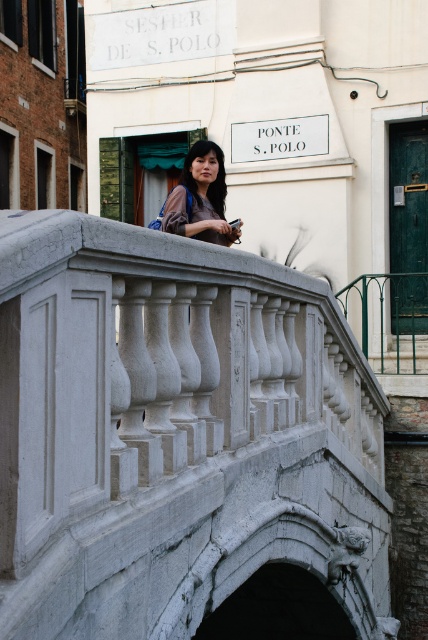
Consider the image. Can you confirm if matte black bag at center is positioned above matte black hair at upper center?

No.

Between matte black bag at center and matte black hair at upper center, which one is positioned higher?

matte black hair at upper center is higher up.

What are the coordinates of `matte black bag at center` in the screenshot? It's located at (201, 196).

Between point (210, 330) and point (192, 179), which one is positioned behind?

The point (192, 179) is more distant.

Is white stone bridge at center bigger than matte black hair at upper center?

Yes, white stone bridge at center is bigger than matte black hair at upper center.

Between point (178, 588) and point (196, 198), which one is positioned in front?

Positioned in front is point (178, 588).

Locate an element on the screen. This screenshot has height=640, width=428. white stone bridge at center is located at coordinates (175, 433).

Is white stone bridge at center below matte black bag at center?

Yes, white stone bridge at center is below matte black bag at center.

Is point (38, 468) in front of point (193, 161)?

Yes, it is in front of point (193, 161).

You are a GUI agent. You are given a task and a screenshot of the screen. Output one action in this format:
    pyautogui.click(x=<x>, y=<y>)
    Task: Click on the white stone bridge at center
    
    Given the screenshot: What is the action you would take?
    click(x=175, y=433)